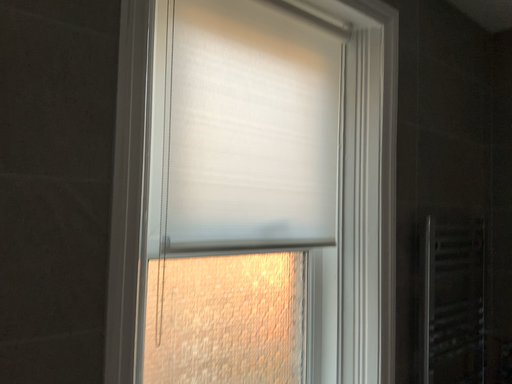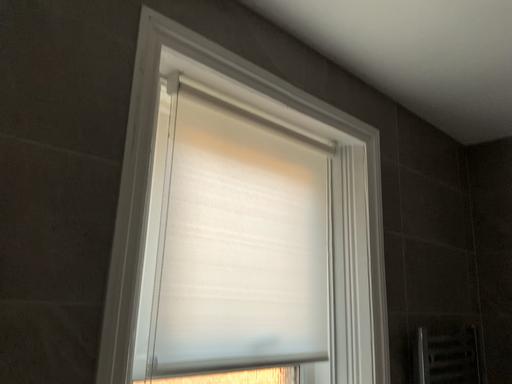
Question: Which way did the camera rotate in the video?

Choices:
 (A) rotated downward
 (B) rotated upward

Answer: (B)